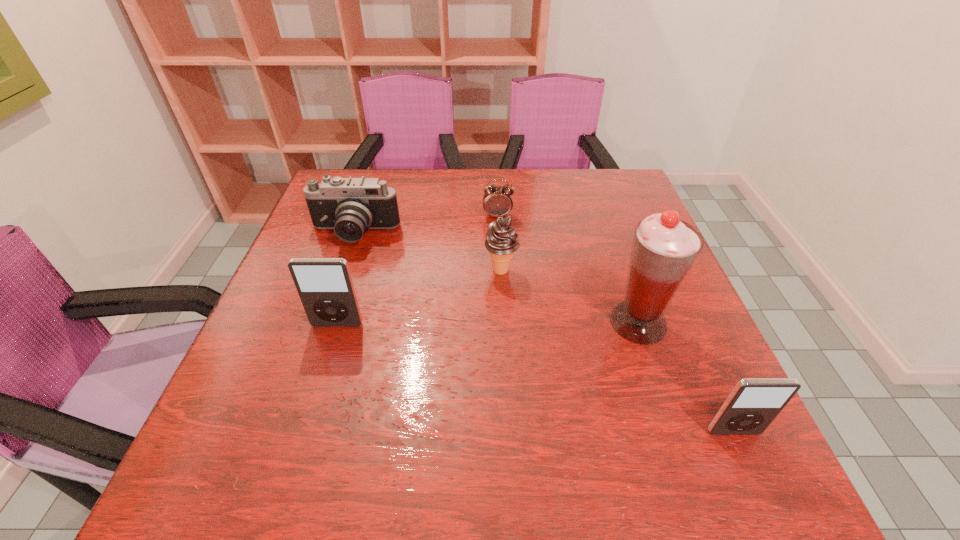
Find the location of `free space located 0.250m on the face of the shortest object`. free space located 0.250m on the face of the shortest object is located at coordinates (501, 283).

Locate an element on the screen. Image resolution: width=960 pixels, height=540 pixels. free space located on the back of the tallest object is located at coordinates (626, 287).

This screenshot has width=960, height=540. Identify the location of vacant region located 0.130m on the front-facing side of the camera. (337, 286).

This screenshot has height=540, width=960. I want to click on vacant region located on the right of the icecream, so click(551, 271).

The image size is (960, 540). In order to click on object that is positioned at the far edge in this screenshot , I will do `click(497, 201)`.

Find the location of `object situated at the near edge`. object situated at the near edge is located at coordinates (752, 405).

At what (x,y) coordinates should I click in order to perform the action: click on iPod situated at the left edge. Please return your answer as a coordinate pair (x, y). This screenshot has height=540, width=960. Looking at the image, I should click on (325, 287).

The height and width of the screenshot is (540, 960). Find the location of `camera at the left edge`. camera at the left edge is located at coordinates (350, 206).

Where is `iPod at the right edge`? This screenshot has width=960, height=540. iPod at the right edge is located at coordinates (752, 405).

This screenshot has width=960, height=540. What are the coordinates of `smoothie that is positioned at the right edge` in the screenshot? It's located at (664, 248).